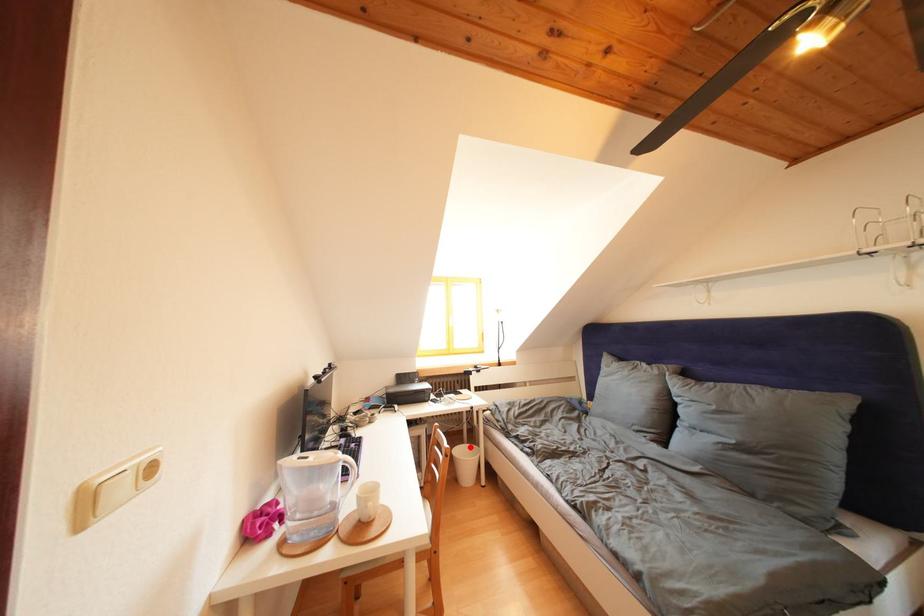
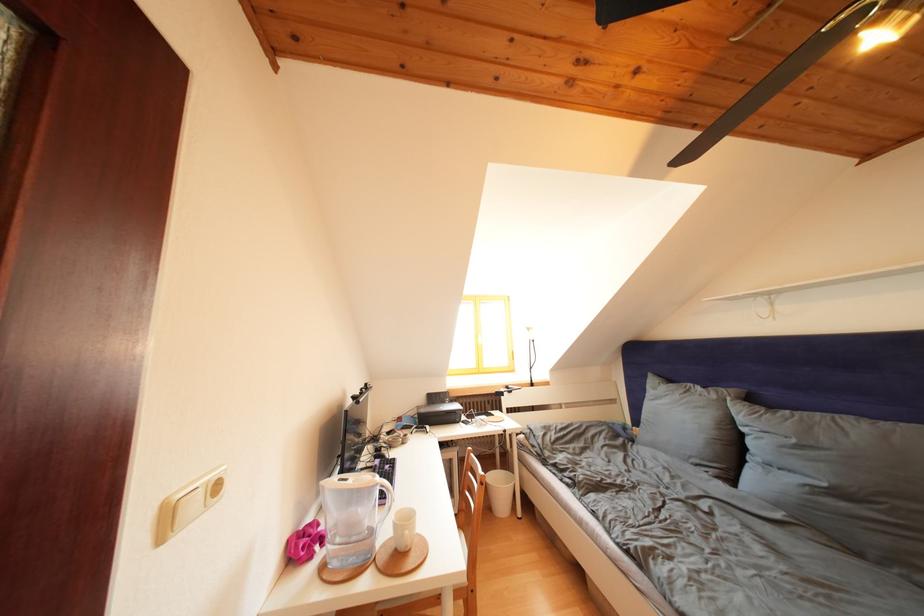
Where in the second image is the point corresponding to the highlighted location from the first image?

(503, 472)